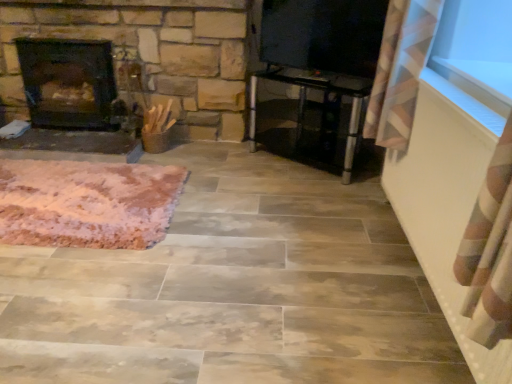
Question: Is transparent glass window screen at upper right further to the viewer compared to dark brown stone fireplace at left?

Choices:
 (A) no
 (B) yes

Answer: (A)

Question: From the image's perspective, is transparent glass window screen at upper right over dark brown stone fireplace at left?

Choices:
 (A) no
 (B) yes

Answer: (B)

Question: From a real-world perspective, is transparent glass window screen at upper right on top of dark brown stone fireplace at left?

Choices:
 (A) no
 (B) yes

Answer: (B)

Question: From the image's perspective, is transparent glass window screen at upper right below dark brown stone fireplace at left?

Choices:
 (A) no
 (B) yes

Answer: (A)

Question: Is dark brown stone fireplace at left surrounded by transparent glass window screen at upper right?

Choices:
 (A) yes
 (B) no

Answer: (B)

Question: In terms of size, does transparent glass window screen at upper right appear bigger or smaller than transparent glass table at center?

Choices:
 (A) big
 (B) small

Answer: (B)

Question: Is point (300, 44) closer or farther from the camera than point (305, 87)?

Choices:
 (A) farther
 (B) closer

Answer: (B)

Question: Based on their positions, is transparent glass window screen at upper right located to the left or right of transparent glass table at center?

Choices:
 (A) right
 (B) left

Answer: (A)

Question: From a real-world perspective, is transparent glass window screen at upper right physically located above or below transparent glass table at center?

Choices:
 (A) above
 (B) below

Answer: (A)

Question: Choose the correct answer: Is dark brown stone fireplace at left inside transparent glass table at center or outside it?

Choices:
 (A) inside
 (B) outside

Answer: (B)

Question: Considering the positions of point (32, 92) and point (360, 100), is point (32, 92) closer or farther from the camera than point (360, 100)?

Choices:
 (A) farther
 (B) closer

Answer: (A)

Question: In the image, is dark brown stone fireplace at left positioned in front of or behind transparent glass table at center?

Choices:
 (A) behind
 (B) front

Answer: (A)

Question: Considering the relative positions of dark brown stone fireplace at left and transparent glass table at center in the image provided, is dark brown stone fireplace at left to the left or to the right of transparent glass table at center?

Choices:
 (A) left
 (B) right

Answer: (A)

Question: In terms of height, does transparent glass table at center look taller or shorter compared to pink fluffy rug at lower left?

Choices:
 (A) tall
 (B) short

Answer: (A)

Question: Is point (301, 109) closer or farther from the camera than point (44, 215)?

Choices:
 (A) farther
 (B) closer

Answer: (A)